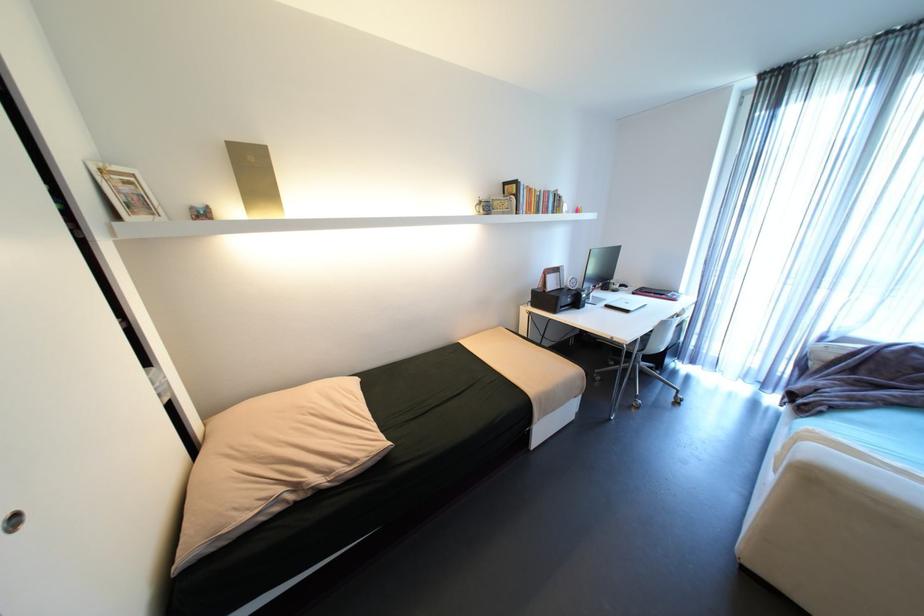
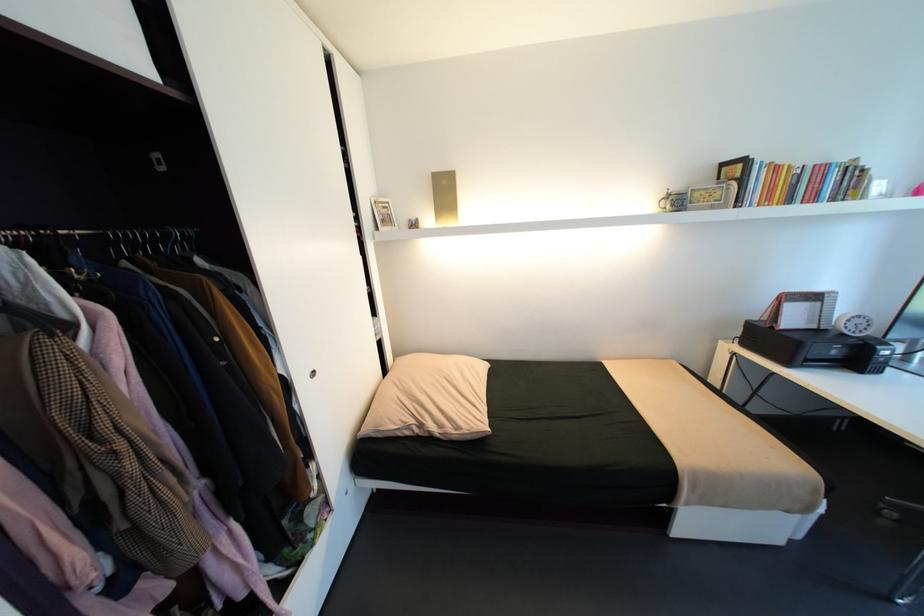
The point at (552, 292) is marked in the first image. Where is the corresponding point in the second image?

(779, 328)